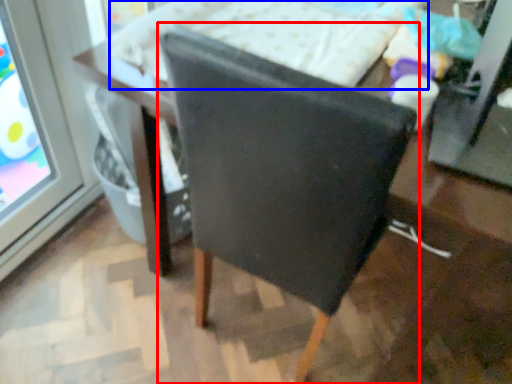
Question: Which object is closer to the camera taking this photo, chair (highlighted by a red box) or bed (highlighted by a blue box)?

Choices:
 (A) chair
 (B) bed

Answer: (A)